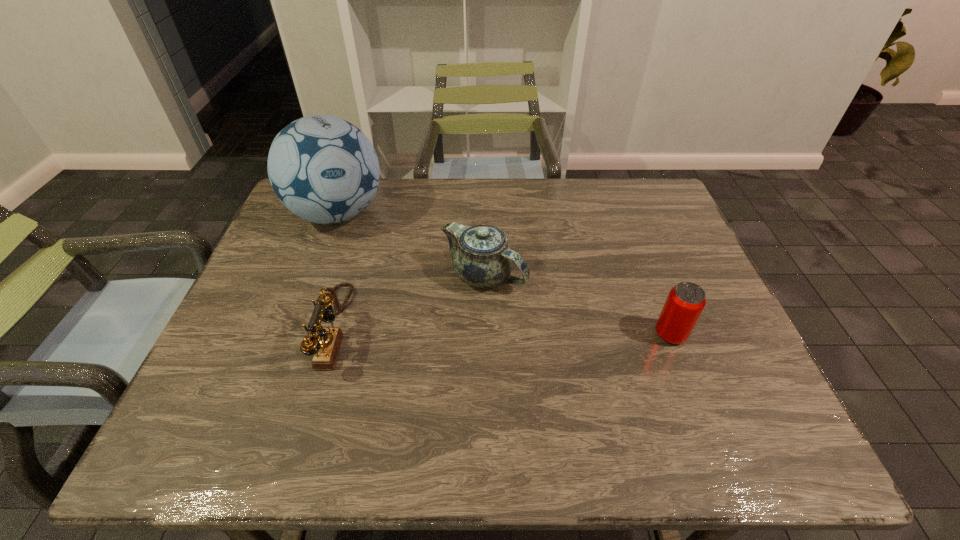
In the image, there is a desktop. At what (x,y) coordinates should I click in order to perform the action: click on free space at the far edge. Please return your answer as a coordinate pair (x, y). Looking at the image, I should click on (559, 183).

In the image, there is a desktop. Identify the location of vacant space at the near edge. The width and height of the screenshot is (960, 540). (615, 393).

In the image, there is a desktop. Identify the location of vacant space at the right edge. This screenshot has height=540, width=960. (668, 278).

Identify the location of vacant space in between the tallest object and the third object from left to right. (411, 245).

Locate an element on the screen. vacant area between the telephone and the farthest object is located at coordinates (335, 271).

This screenshot has width=960, height=540. Identify the location of vacant point located between the telephone and the tallest object. (335, 271).

At what (x,y) coordinates should I click in order to perform the action: click on vacant area between the telephone and the can. Please return your answer as a coordinate pair (x, y). This screenshot has width=960, height=540. Looking at the image, I should click on (501, 332).

Image resolution: width=960 pixels, height=540 pixels. I want to click on free space between the chinaware and the telephone, so tap(408, 302).

Find the location of a particular element. Image resolution: width=960 pixels, height=540 pixels. vacant space in between the soccer ball and the chinaware is located at coordinates (411, 245).

The width and height of the screenshot is (960, 540). Find the location of `vacant area that lies between the rightmost object and the telephone`. vacant area that lies between the rightmost object and the telephone is located at coordinates (501, 332).